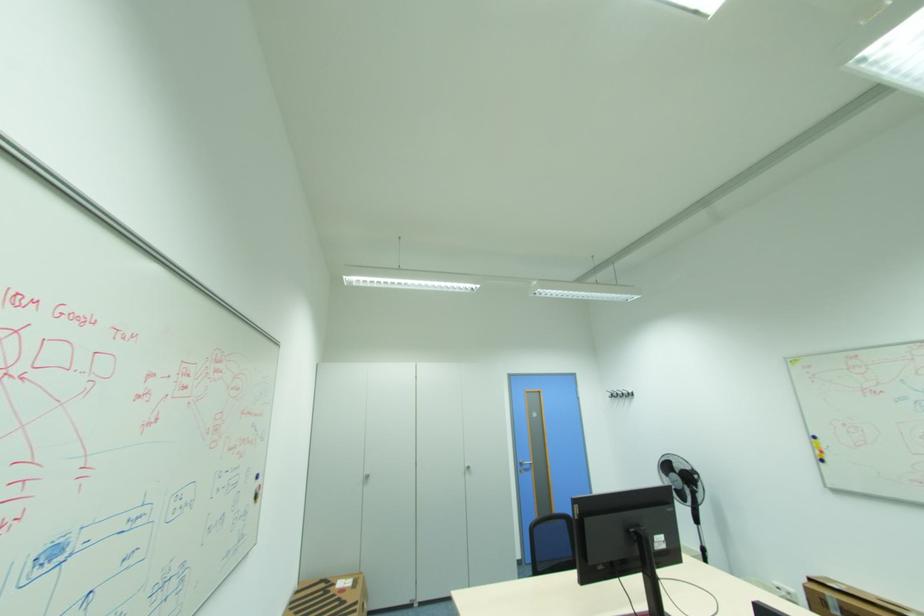
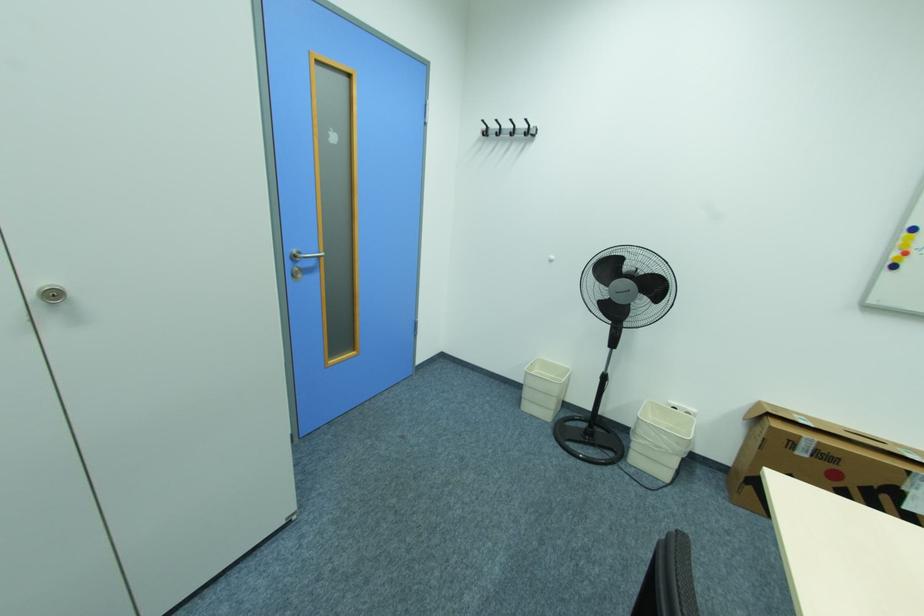
Where in the second image is the point corresponding to (475,468) from the first image?

(64, 294)